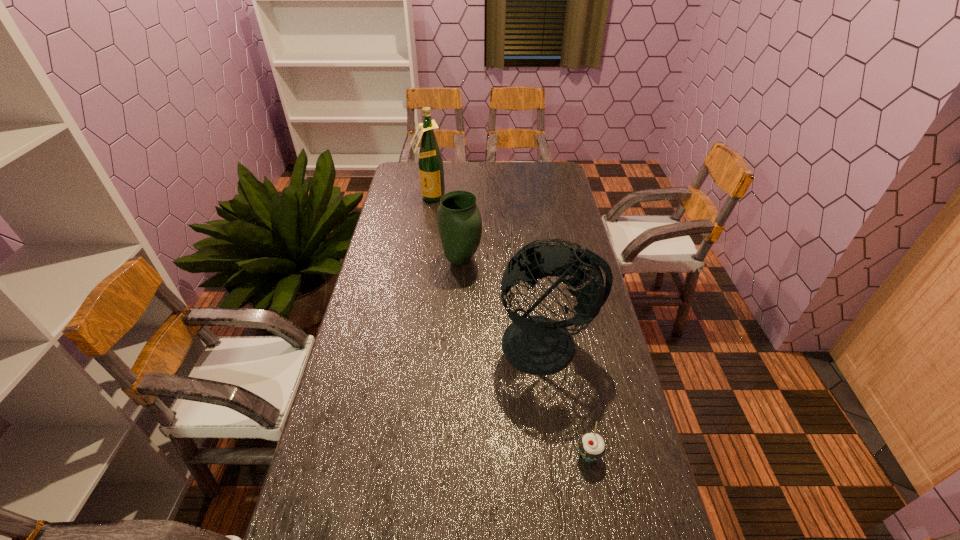
Image resolution: width=960 pixels, height=540 pixels. Identify the location of the leftmost object. (430, 162).

Locate an element on the screen. The image size is (960, 540). liquor is located at coordinates (430, 162).

Identify the location of globe. This screenshot has height=540, width=960. (536, 344).

Find the location of `vase`. vase is located at coordinates click(459, 221).

At what (x,y) coordinates should I click in order to perform the action: click on the third object from right to left. Please return your answer as a coordinate pair (x, y). The width and height of the screenshot is (960, 540). Looking at the image, I should click on point(459,221).

The width and height of the screenshot is (960, 540). I want to click on cupcake, so click(592, 447).

In order to click on the nearest object in this screenshot , I will do pyautogui.click(x=592, y=447).

Identify the location of free point located on the front-facing side of the liquor. (425, 231).

I want to click on blank area located on the front-facing side of the second nearest object, so click(x=559, y=424).

The image size is (960, 540). What are the coordinates of `vacant space located 0.340m on the back of the third nearest object` in the screenshot? It's located at (464, 200).